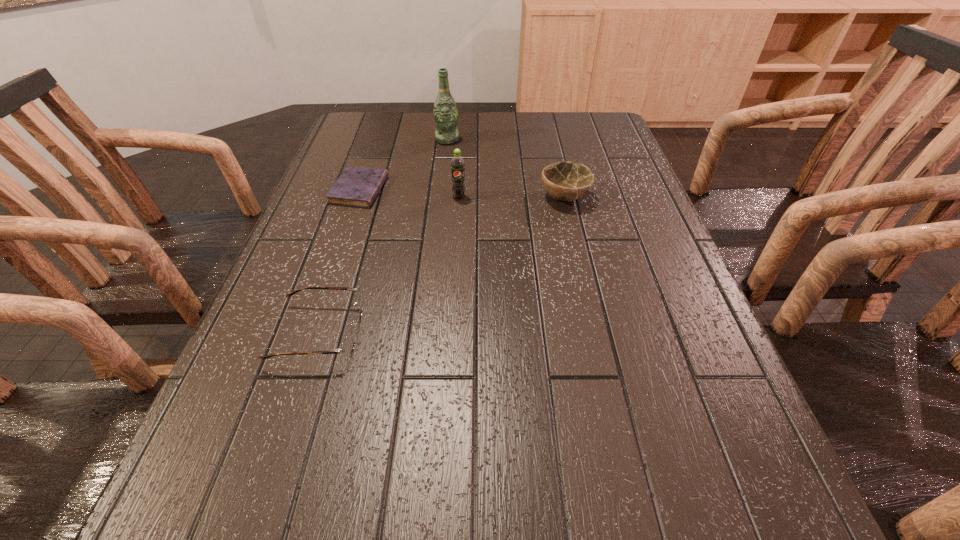
Find the location of a particular element. Image resolution: width=960 pixels, height=540 pixels. vacant space situated on the back of the third tallest object is located at coordinates (546, 121).

Identify the location of free point located 0.150m on the front-facing side of the spectacles. (440, 333).

Where is `vacant region located 0.130m on the back of the diary`? vacant region located 0.130m on the back of the diary is located at coordinates (373, 150).

Find the location of `object that is at the far edge`. object that is at the far edge is located at coordinates pos(445,113).

You are a GUI agent. You are given a task and a screenshot of the screen. Output one action in this format:
    pyautogui.click(x=<x>, y=<y>)
    Task: Click on the spectacles that is at the left edge
    
    Given the screenshot: What is the action you would take?
    pyautogui.click(x=347, y=346)

Locate an element on the screen. diary present at the left edge is located at coordinates (358, 187).

Find the location of `object that is at the right edge`. object that is at the right edge is located at coordinates click(566, 181).

The width and height of the screenshot is (960, 540). In order to click on free region at the far edge of the desktop in this screenshot , I will do `click(518, 129)`.

In the image, there is a desktop. At what (x,y) coordinates should I click in order to perform the action: click on vacant area at the left edge. Please return your answer as a coordinate pair (x, y). This screenshot has width=960, height=540. Looking at the image, I should click on (272, 462).

Identify the location of vacant region at the right edge. The width and height of the screenshot is (960, 540). (627, 235).